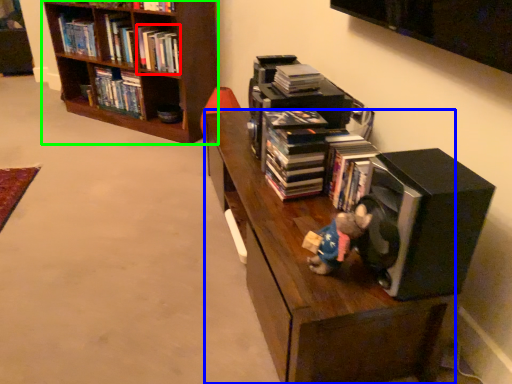
Question: Which object is positioned farthest from book (highlighted by a red box)? Select from shelf (highlighted by a blue box) and bookcase (highlighted by a green box).

Choices:
 (A) shelf
 (B) bookcase

Answer: (A)